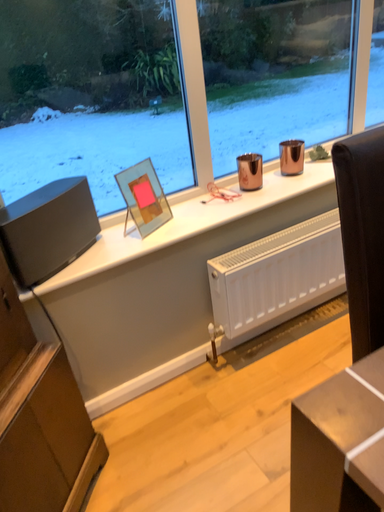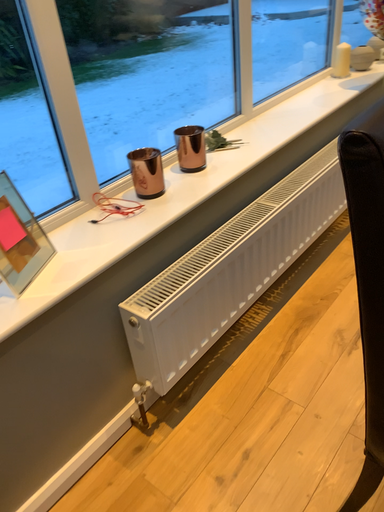
Question: Which way did the camera rotate in the video?

Choices:
 (A) rotated right
 (B) rotated left

Answer: (A)